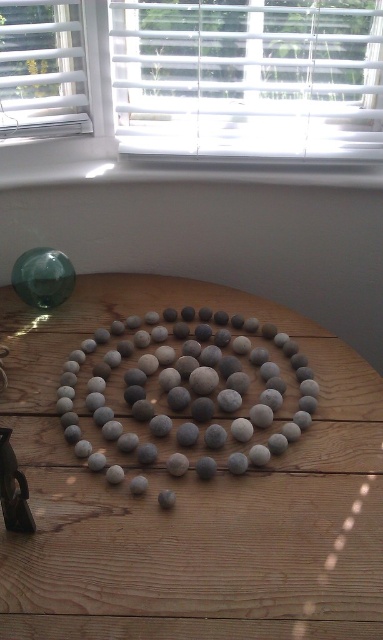
You are standing in front of the wooden table with the circular stone arrangement. There are two points marked on the table surface, one at coordinates point [60,45] and the other at point [332,179]. Which of these two points is closer to you?

Point [60,45] is closer to the viewer than point [332,179].

You are a photographer setting up a shot of the smooth gray pebbles at center and the white plastic window sill at upper center. Which object should you focus on first to ensure both are in sharp focus?

You should focus on the smooth gray pebbles at center first because it is closer to you than the white plastic window sill at upper center, so adjusting focus from near to far will help both be sharp.

You are standing at the edge of the table looking towards the window. Which of the two points, point (255, 515) or point (40, 115), is closer to you?

Point (40, 115) is closer to you because it is behind point (255, 515), meaning the latter is farther away from your position at the edge of the table.